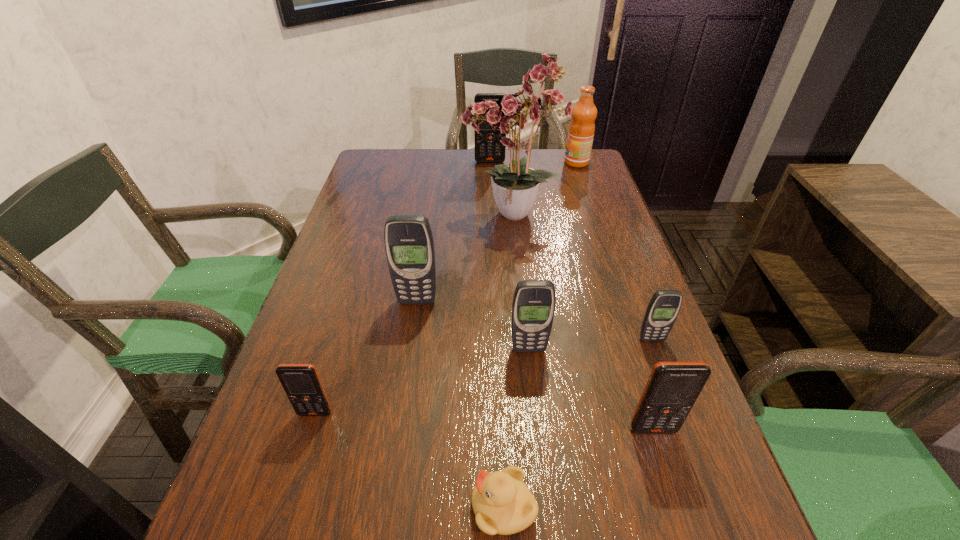
Where is `the third closest orange cellular telephone to the nearest gray cellular telephone`? Image resolution: width=960 pixels, height=540 pixels. the third closest orange cellular telephone to the nearest gray cellular telephone is located at coordinates (485, 147).

You are a GUI agent. You are given a task and a screenshot of the screen. Output one action in this format:
    pyautogui.click(x=<x>, y=<y>)
    Task: Click on the gray cellular telephone identified as the closest to the seventh nearest object
    This screenshot has height=540, width=960.
    Given the screenshot: What is the action you would take?
    pyautogui.click(x=409, y=245)

At what (x,y) coordinates should I click in order to perform the action: click on the third closest gray cellular telephone to the second nearest object. Please return your answer as a coordinate pair (x, y). The width and height of the screenshot is (960, 540). Looking at the image, I should click on (409, 245).

This screenshot has width=960, height=540. What are the coordinates of `free space that satisfies the following two spatial constraints: 1. on the label side of the fruit juice; 2. on the screen of the fourth farthest cellular telephone` in the screenshot? It's located at (640, 349).

Locate an element on the screen. free region that satisfies the following two spatial constraints: 1. on the label side of the fruit juice; 2. on the screen of the third nearest object is located at coordinates (661, 413).

The image size is (960, 540). Find the location of `free location that satisfies the following two spatial constraints: 1. on the front-facing side of the pink flower arrangement; 2. on the screen of the smallest orange cellular telephone`. free location that satisfies the following two spatial constraints: 1. on the front-facing side of the pink flower arrangement; 2. on the screen of the smallest orange cellular telephone is located at coordinates (528, 413).